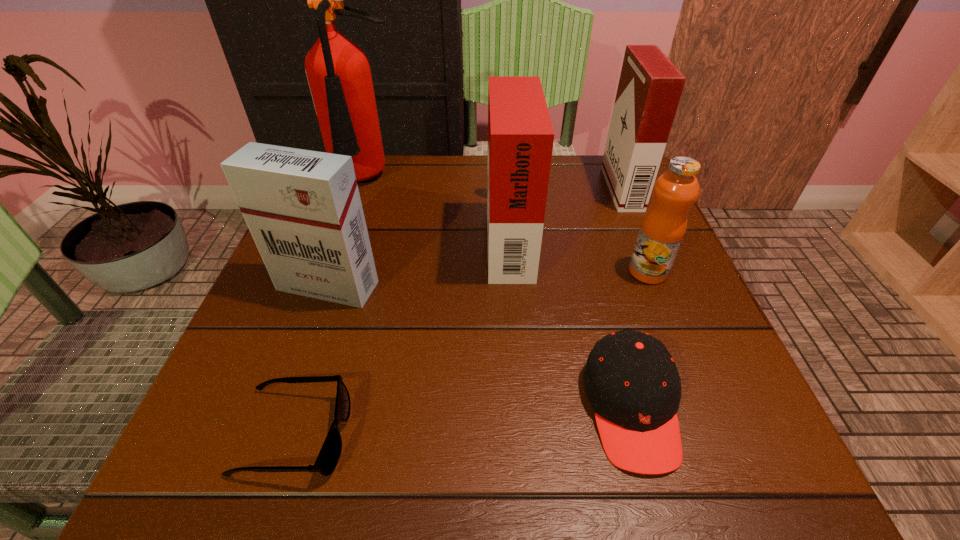
Identify the location of the tallest object. (338, 71).

At what (x,y) coordinates should I click in order to perform the action: click on the second cigarette case from right to left. Please return your answer as a coordinate pair (x, y). This screenshot has height=540, width=960. Looking at the image, I should click on (520, 135).

Identify the location of the rightmost cigarette case. Image resolution: width=960 pixels, height=540 pixels. (650, 86).

Image resolution: width=960 pixels, height=540 pixels. Identify the location of the leftmost cigarette case. (303, 209).

Identify the location of fruit juice. The width and height of the screenshot is (960, 540). (664, 225).

I want to click on cap, so click(631, 380).

I want to click on the third object from right to left, so click(631, 380).

The image size is (960, 540). I want to click on the shortest object, so click(x=326, y=462).

The height and width of the screenshot is (540, 960). Find the location of `vacant region located 0.060m at the nozzle of the fire extinguisher`. vacant region located 0.060m at the nozzle of the fire extinguisher is located at coordinates tap(354, 219).

At what (x,y) coordinates should I click in order to perform the action: click on free space located on the front-facing side of the fourth object from right to left. Please return your answer as a coordinate pair (x, y). This screenshot has height=540, width=960. Looking at the image, I should click on (330, 237).